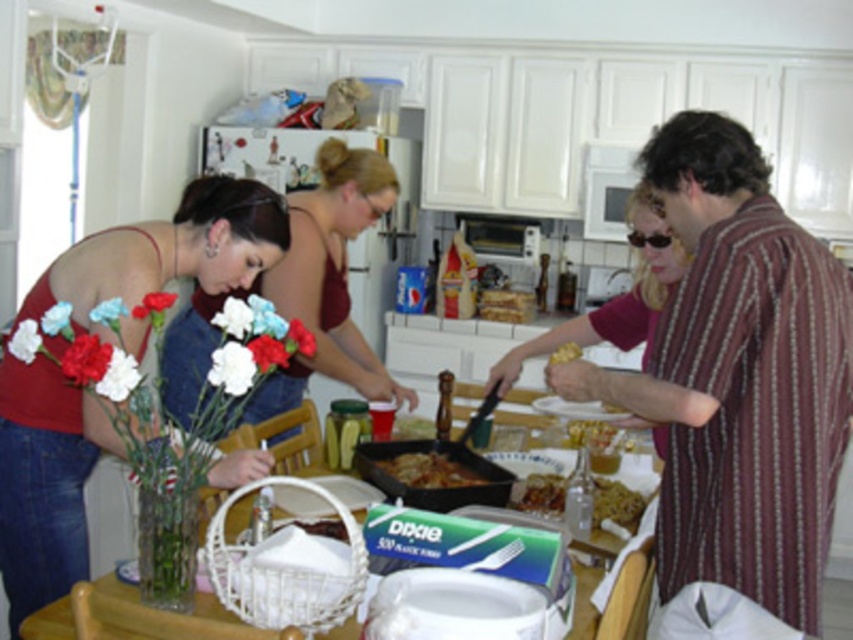
You are a guest at a potluck and need to grab a pastry quickly. The brown matte pan at center is blocking your path to the golden crispy pastry at right. Can you reach the pastry without moving the pan?

The golden crispy pastry at right is behind the brown matte pan at center, so you can reach it without moving the pan by going around it or lifting the pan slightly if possible.

You are standing in the kitchen and want to reach both points on the table. Which point, point (467, 474) or point (567, 360), is closer to you?

Point (467, 474) is closer to you because it is further to the viewer than point (567, 360).